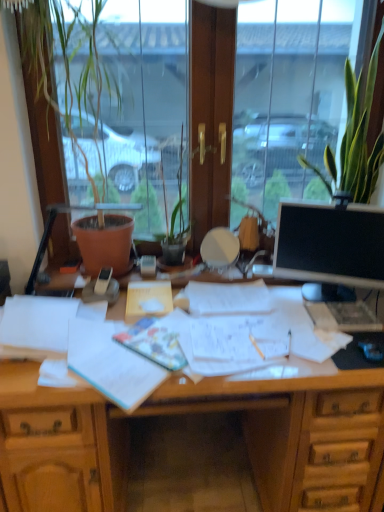
Question: Is wooden desk at center far from black glossy monitor at right?

Choices:
 (A) no
 (B) yes

Answer: (A)

Question: From a real-world perspective, is wooden desk at center beneath black glossy monitor at right?

Choices:
 (A) no
 (B) yes

Answer: (B)

Question: Can you confirm if wooden desk at center is smaller than black glossy monitor at right?

Choices:
 (A) no
 (B) yes

Answer: (A)

Question: Does wooden desk at center have a lesser height compared to black glossy monitor at right?

Choices:
 (A) yes
 (B) no

Answer: (B)

Question: Does wooden desk at center have a greater width compared to black glossy monitor at right?

Choices:
 (A) yes
 (B) no

Answer: (A)

Question: Is green leafy plant at upper right inside the boundaries of matte black phone at center, or outside?

Choices:
 (A) outside
 (B) inside

Answer: (A)

Question: Is green leafy plant at upper right taller or shorter than matte black phone at center?

Choices:
 (A) short
 (B) tall

Answer: (B)

Question: Does point (347, 187) appear closer or farther from the camera than point (107, 276)?

Choices:
 (A) farther
 (B) closer

Answer: (A)

Question: From the image's perspective, is green leafy plant at upper right positioned above or below matte black phone at center?

Choices:
 (A) below
 (B) above

Answer: (B)

Question: Is matte black phone at center bigger or smaller than black glossy monitor at right?

Choices:
 (A) big
 (B) small

Answer: (B)

Question: Which is correct: matte black phone at center is inside black glossy monitor at right, or outside of it?

Choices:
 (A) outside
 (B) inside

Answer: (A)

Question: Relative to black glossy monitor at right, is matte black phone at center in front or behind?

Choices:
 (A) front
 (B) behind

Answer: (B)

Question: From a real-world perspective, is matte black phone at center physically located above or below black glossy monitor at right?

Choices:
 (A) below
 (B) above

Answer: (A)

Question: From their relative heights in the image, would you say light blue paper at center, positioned as the first document in bottom-to-top order, is taller or shorter than green leafy plant at upper right?

Choices:
 (A) tall
 (B) short

Answer: (B)

Question: Considering the positions of light blue paper at center, the second document from the back, and green leafy plant at upper right in the image, is light blue paper at center, the second document from the back, wider or thinner than green leafy plant at upper right?

Choices:
 (A) thin
 (B) wide

Answer: (B)